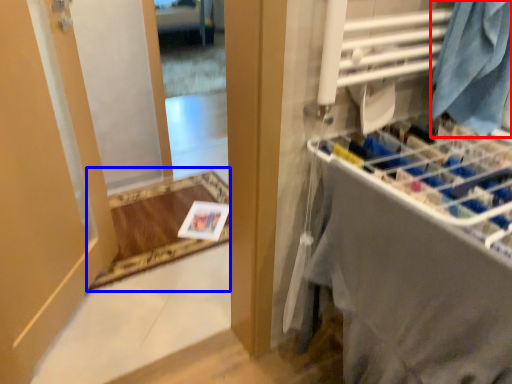
Question: Which of the following is the farthest to the observer, clothing (highlighted by a red box) or mat (highlighted by a blue box)?

Choices:
 (A) clothing
 (B) mat

Answer: (B)